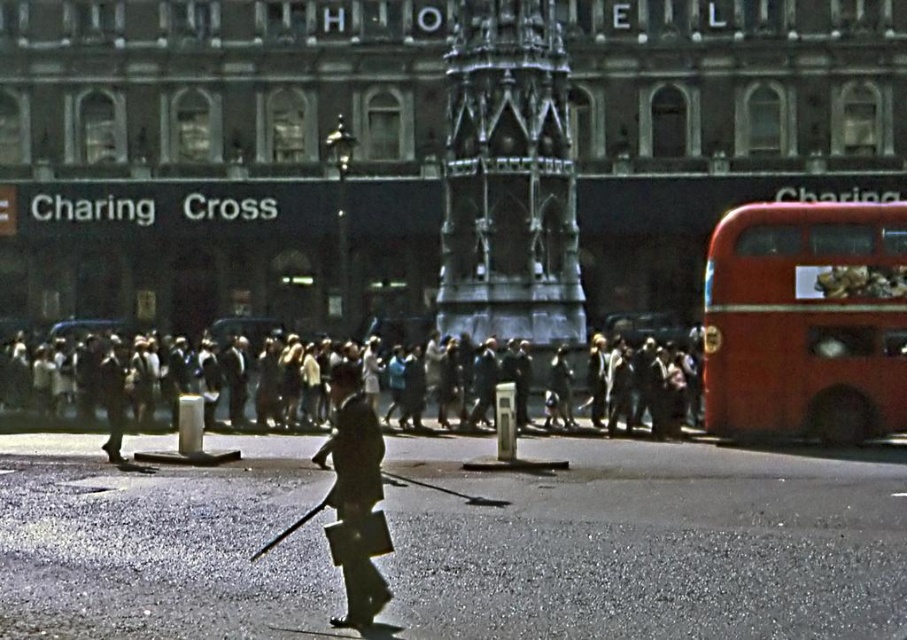
Between point (768, 328) and point (345, 579), which one is positioned in front?

Point (345, 579)

Can you confirm if red rubber bus at right is positioned below dark gray uniform at center?

No, red rubber bus at right is not below dark gray uniform at center.

Where is `red rubber bus at right`? red rubber bus at right is located at coordinates (806, 321).

Can you confirm if dark gray concrete crowd at center is wider than dark gray uniform at center?

Yes.

Is dark gray concrete crowd at center bigger than dark gray uniform at center?

Correct, dark gray concrete crowd at center is larger in size than dark gray uniform at center.

Is point (597, 396) positioned in front of point (335, 625)?

No, it is not.

The image size is (907, 640). Identify the location of dark gray concrete crowd at center. (88, 381).

Is point (779, 417) in front of point (8, 400)?

Yes, point (779, 417) is closer to viewer.

Is red rubber bus at right wider than dark gray concrete crowd at center?

In fact, red rubber bus at right might be narrower than dark gray concrete crowd at center.

Between point (802, 355) and point (46, 349), which one is positioned in front?

Point (802, 355) is more forward.

I want to click on red rubber bus at right, so click(x=806, y=321).